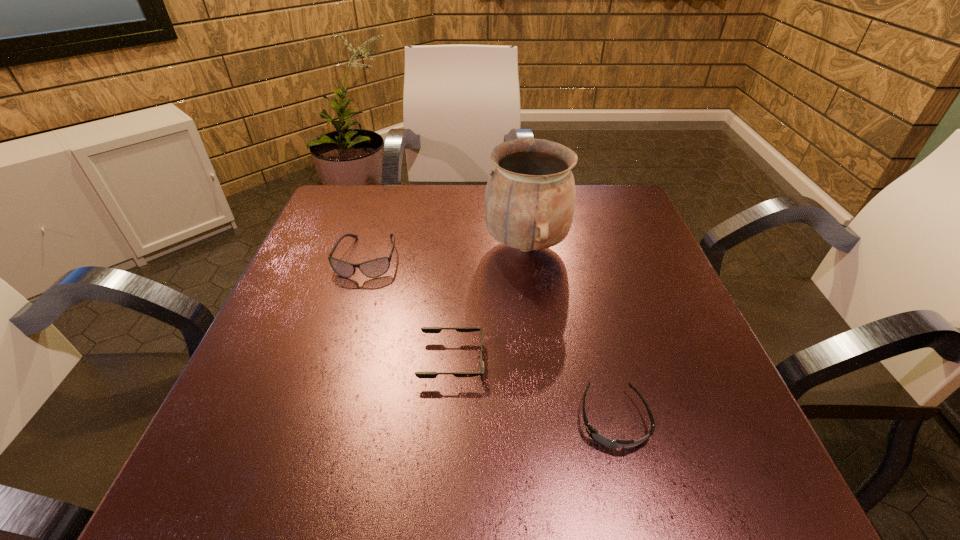
You are a GUI agent. You are given a task and a screenshot of the screen. Output one action in this format:
    pyautogui.click(x=<x>, y=<y>)
    Task: Click on the free space at the far left corner of the desktop
    The height and width of the screenshot is (540, 960).
    Given the screenshot: What is the action you would take?
    click(x=334, y=191)

The width and height of the screenshot is (960, 540). Identify the location of free location at the near left corner. (257, 463).

The image size is (960, 540). What are the coordinates of `vacant space at the far right corner of the desktop` in the screenshot? It's located at (636, 209).

Locate an element on the screen. This screenshot has width=960, height=540. free space between the nearest object and the second nearest object is located at coordinates (533, 390).

Find the location of `vacant area that lies between the tallest sunglasses and the urn`. vacant area that lies between the tallest sunglasses and the urn is located at coordinates (446, 252).

At what (x,y) coordinates should I click in order to perform the action: click on unoccupied area between the third shortest object and the nearest object. Please return your answer as a coordinate pair (x, y). This screenshot has width=960, height=540. Looking at the image, I should click on (490, 339).

Find the location of a particular element. vacant space that's between the leftmost object and the tallest object is located at coordinates (446, 252).

Where is `empty space that is in between the urn and the tallest sunglasses`? Image resolution: width=960 pixels, height=540 pixels. empty space that is in between the urn and the tallest sunglasses is located at coordinates (446, 252).

Identify the location of empty space between the tallest object and the rightmost sunglasses. (569, 333).

The width and height of the screenshot is (960, 540). I want to click on vacant region between the nearest sunglasses and the third object from right to left, so click(x=533, y=390).